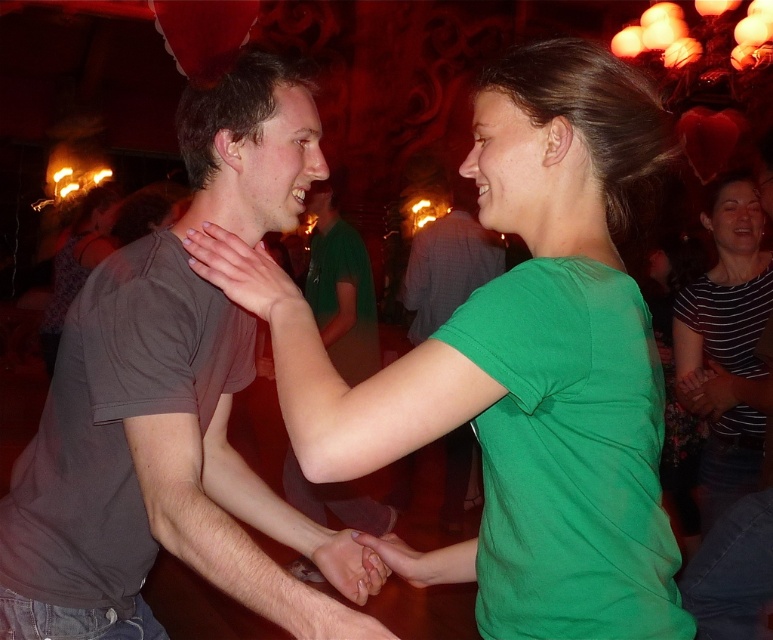
You are at a party and notice two green items in the center of the image. The items are the green matte shirt at center and the matte green hand at center. Which one is located to the right?

The green matte shirt at center is positioned on the right side of the matte green hand at center, so the green matte shirt at center is located to the right.